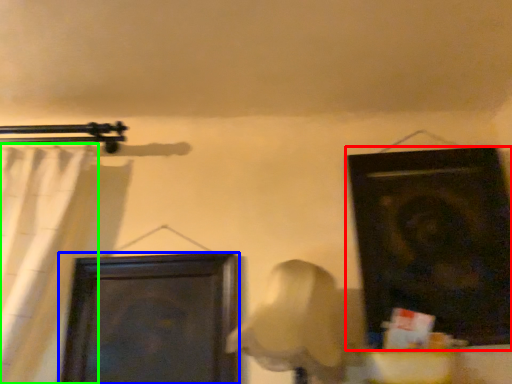
Question: Which is farther away from door (highlighted by a red box)? door (highlighted by a blue box) or curtain (highlighted by a green box)?

Choices:
 (A) door
 (B) curtain

Answer: (B)